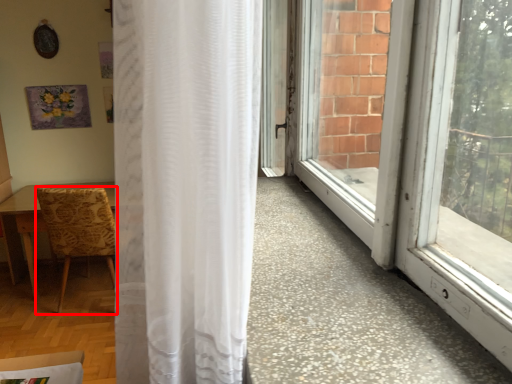
Question: From the image's perspective, what is the correct spatial positioning of chair (annotated by the red box) in reference to curtain?

Choices:
 (A) above
 (B) below

Answer: (B)